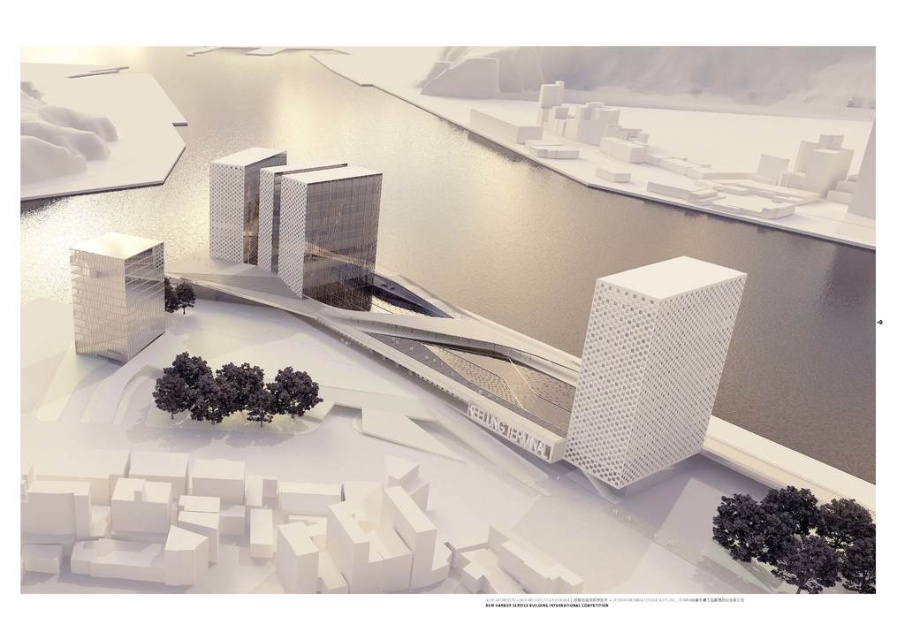
Is metallic glass tower at center above polished glass tower at center?

Actually, metallic glass tower at center is below polished glass tower at center.

Can you confirm if metallic glass tower at center is shorter than polished glass tower at center?

In fact, metallic glass tower at center may be taller than polished glass tower at center.

Between point (284, 211) and point (252, 234), which one is positioned in front?

Point (284, 211)

Image resolution: width=905 pixels, height=640 pixels. In order to click on metallic glass tower at center in this screenshot , I will do `click(329, 234)`.

Is point (614, 372) less distant than point (318, 225)?

Yes.

In order to click on white perforated cube at center-right in this screenshot , I will do `click(650, 368)`.

Is white textured cube at lower left shorter than polished glass tower at center?

Indeed, white textured cube at lower left has a lesser height compared to polished glass tower at center.

Can you confirm if white textured cube at lower left is wider than polished glass tower at center?

No, white textured cube at lower left is not wider than polished glass tower at center.

Is point (120, 246) positioned before point (245, 236)?

Yes.

At what (x,y) coordinates should I click in order to perform the action: click on white textured cube at lower left. Please return your answer as a coordinate pair (x, y). Looking at the image, I should click on (116, 294).